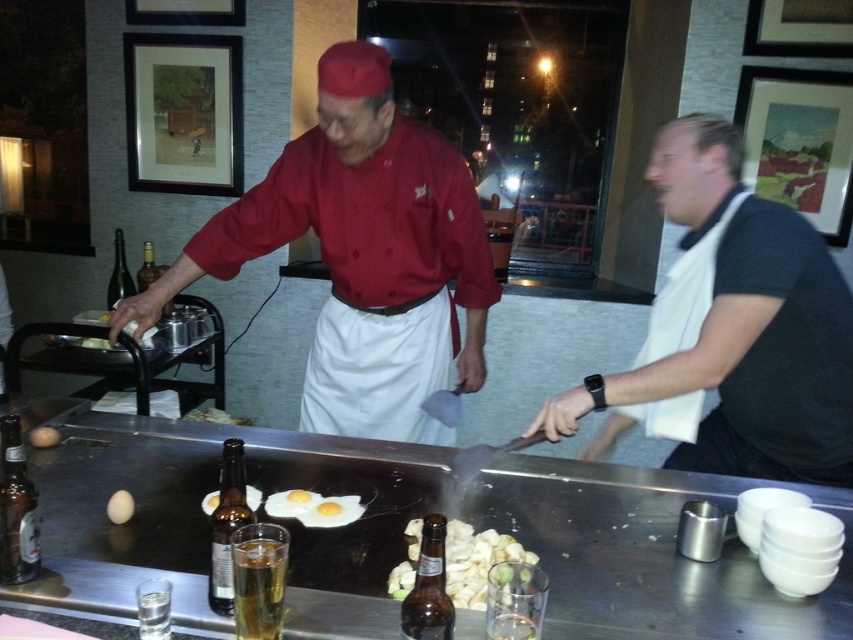
You are a customer at the teppanyaki restaurant and want to grab a drink. The translucent glass bottle at left contains water, and the white towel at right is for drying hands. Which item is wider so you can reach it easily?

The white towel at right might be wider than the translucent glass bottle at left, so it is easier to reach.

From the picture: You are a customer in the teppanyaki restaurant and want to point out the white cotton apron at center and the brown glass bottle at lower left to the staff. Which object is located to the right of the other?

The white cotton apron at center is positioned on the right side of brown glass bottle at lower left.

Looking at this image, you are a customer sitting at the teppanyaki table and want to reach both the point at (x=325, y=170) and the point at (x=277, y=605) on the cooking surface. Which point will require you to reach further away from your seat?

The point at (x=277, y=605) will require reaching further away from your seat because it is positioned farther from the viewer compared to the point at (x=325, y=170).